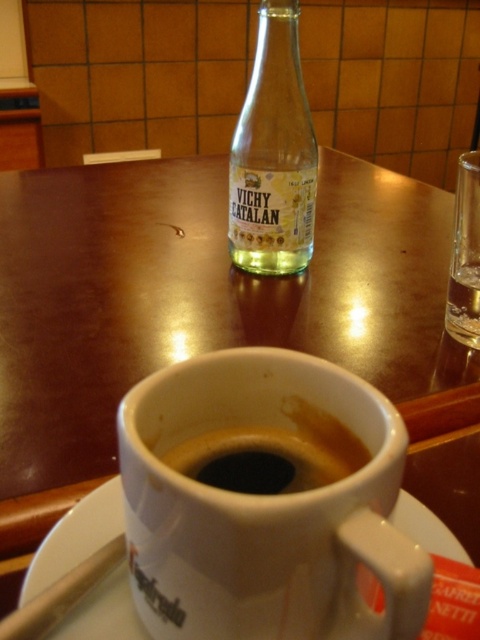
Which is below, white matte mug at center or clear glass at upper right?

white matte mug at center

Does white matte mug at center appear on the right side of clear glass at upper right?

In fact, white matte mug at center is to the left of clear glass at upper right.

Is point (312, 374) in front of point (459, 269)?

Yes, point (312, 374) is in front of point (459, 269).

In order to click on white matte mug at center in this screenshot , I will do `click(265, 500)`.

Is clear glass bottle at center above white ceramic saucer at lower center?

Yes, clear glass bottle at center is above white ceramic saucer at lower center.

What do you see at coordinates (274, 154) in the screenshot?
I see `clear glass bottle at center` at bounding box center [274, 154].

Identify the location of clear glass bottle at center. The image size is (480, 640). (274, 154).

Does clear glass bottle at center come behind black matte coffee at center?

Yes, it is.

Consider the image. Can you confirm if clear glass bottle at center is wider than black matte coffee at center?

Indeed, clear glass bottle at center has a greater width compared to black matte coffee at center.

Identify the location of clear glass bottle at center. (274, 154).

You are a GUI agent. You are given a task and a screenshot of the screen. Output one action in this format:
    pyautogui.click(x=<x>, y=<y>)
    Task: Click on the clear glass bottle at center
    
    Given the screenshot: What is the action you would take?
    pyautogui.click(x=274, y=154)